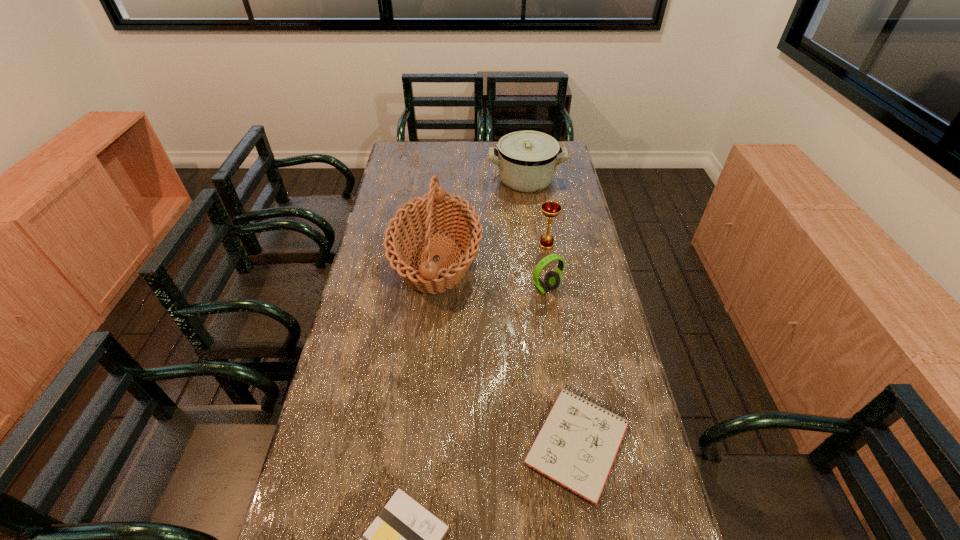
Locate an element on the screen. vacant space at the far left corner of the desktop is located at coordinates (425, 161).

The width and height of the screenshot is (960, 540). I want to click on unoccupied area between the tallest object and the farthest object, so click(481, 220).

Find the location of a particular element. This screenshot has height=540, width=960. free spot between the second shortest object and the farthest object is located at coordinates (552, 311).

You are a GUI agent. You are given a task and a screenshot of the screen. Output one action in this format:
    pyautogui.click(x=<x>, y=<y>)
    Task: Click on the free space between the basket and the farthest object
    The height and width of the screenshot is (540, 960).
    Given the screenshot: What is the action you would take?
    pyautogui.click(x=481, y=220)

At what (x,y) coordinates should I click in order to perform the action: click on free spot between the chalice and the basket. Please return your answer as a coordinate pair (x, y). Looking at the image, I should click on (492, 252).

Point out which object is positioned as the third nearest to the fifth tallest object. Please provide its 2D coordinates. Your answer should be formatted as a tuple, i.e. [(x, y)], where the tuple contains the x and y coordinates of a point satisfying the conditions above.

[(552, 279)]

This screenshot has height=540, width=960. I want to click on object that is the third closest to the taller notepad, so click(552, 279).

Where is `free location that satisfies the following two spatial constraints: 1. on the front side of the tallest object; 2. on the left side of the headset`? free location that satisfies the following two spatial constraints: 1. on the front side of the tallest object; 2. on the left side of the headset is located at coordinates (434, 289).